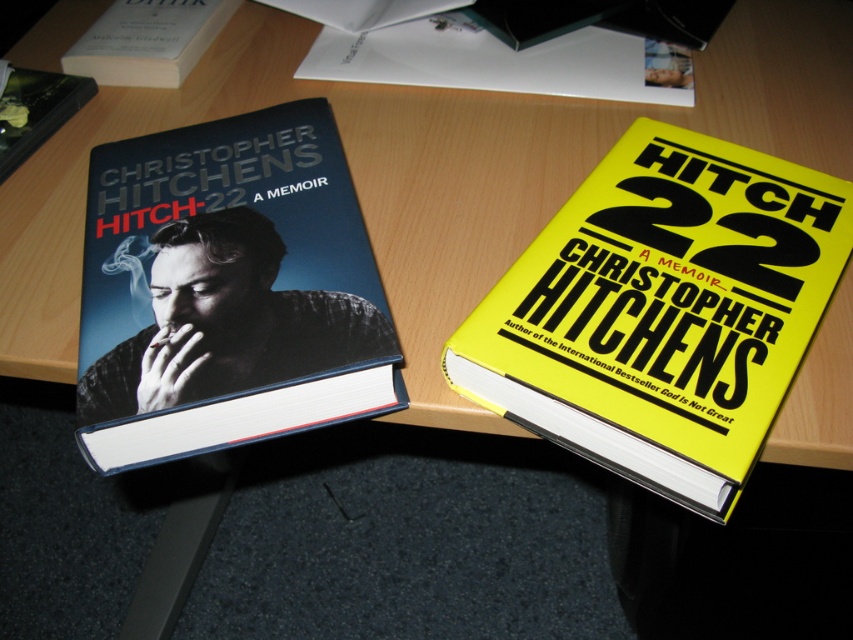
From the picture: You are standing in front of the desk with two books. You need to reach a point closer to you to pick up an object. Which point should you choose between point [705,497] and point [102,145]?

You should choose point [705,497] because it is closer to you than point [102,145].

You are a book collector who wants to place a new book on the desk. You have a book that is 30 centimeters long. Can you fit it between the yellow matte book at center and the edge of the desk?

The yellow matte book at center is 40.82 centimeters away from the viewer. However, the distance between the yellow matte book and the desk edge isn not provided, so it is impossible to determine if the 30 cm book will fit.

Where is the yellow matte book at center located on the desk?

The yellow matte book at center is located at point coordinates of 0.487 on the x axis and 0.777 on the y axis.